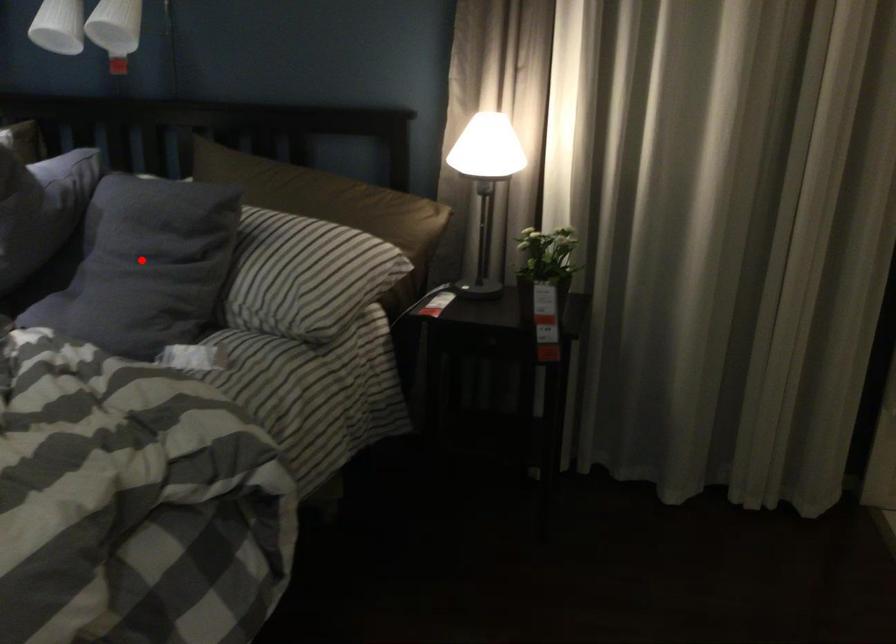
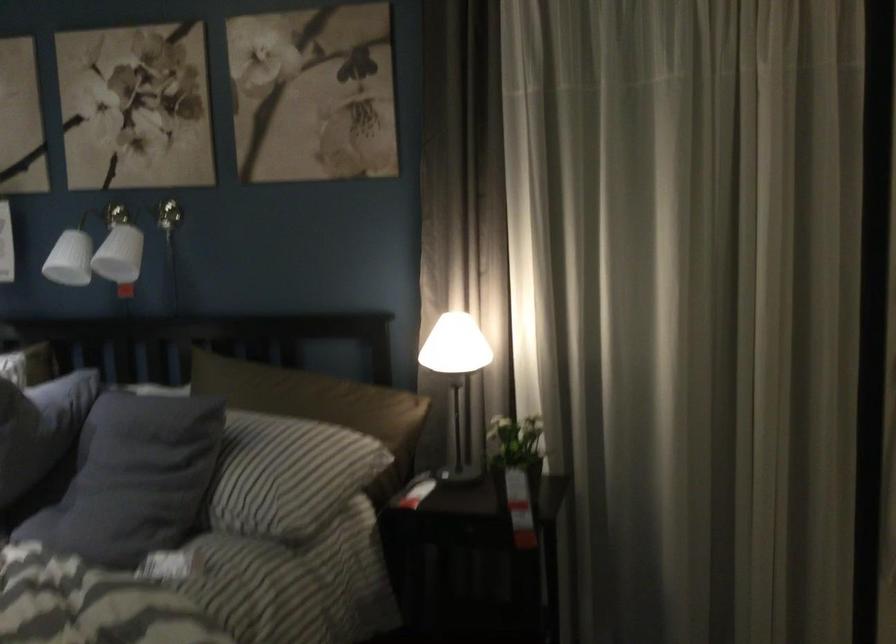
Find the pixel in the second image that matches the highlighted location in the first image.

(131, 473)